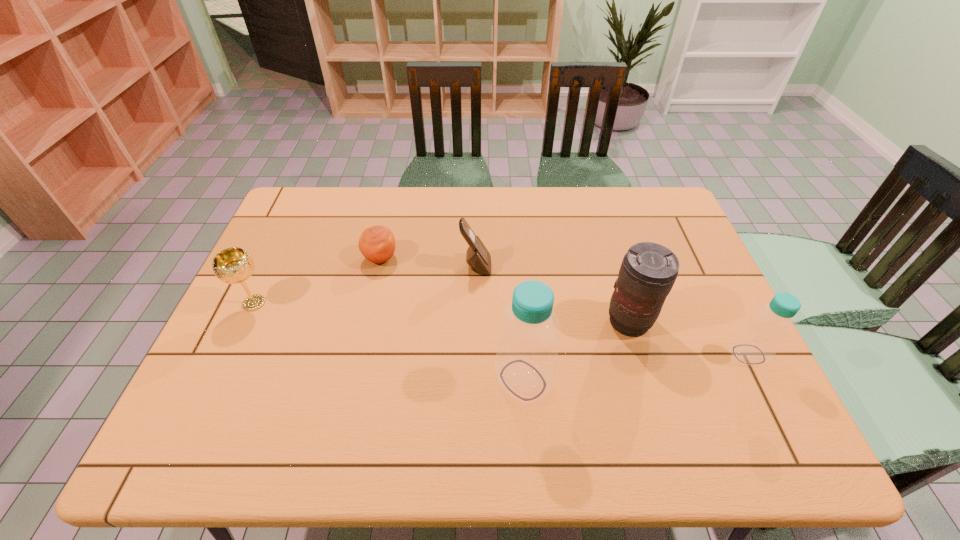
Identify the location of the taller bottle. pos(526,361).

The width and height of the screenshot is (960, 540). I want to click on the left bottle, so click(x=526, y=361).

The width and height of the screenshot is (960, 540). Find the location of `the shorter bottle`. the shorter bottle is located at coordinates (757, 342).

Identify the location of the rightmost object. The height and width of the screenshot is (540, 960). (757, 342).

Locate an element on the screen. This screenshot has width=960, height=540. the shortest object is located at coordinates (377, 244).

Identify the location of orange. This screenshot has height=540, width=960. (377, 244).

Image resolution: width=960 pixels, height=540 pixels. I want to click on chalice, so click(234, 265).

Find the location of a particular element. cellular telephone is located at coordinates (478, 258).

Where is `telephoto lens`? This screenshot has width=960, height=540. telephoto lens is located at coordinates (648, 271).

Find the location of a particular element. This screenshot has width=960, height=540. vacant space situated on the left of the taller bottle is located at coordinates (340, 380).